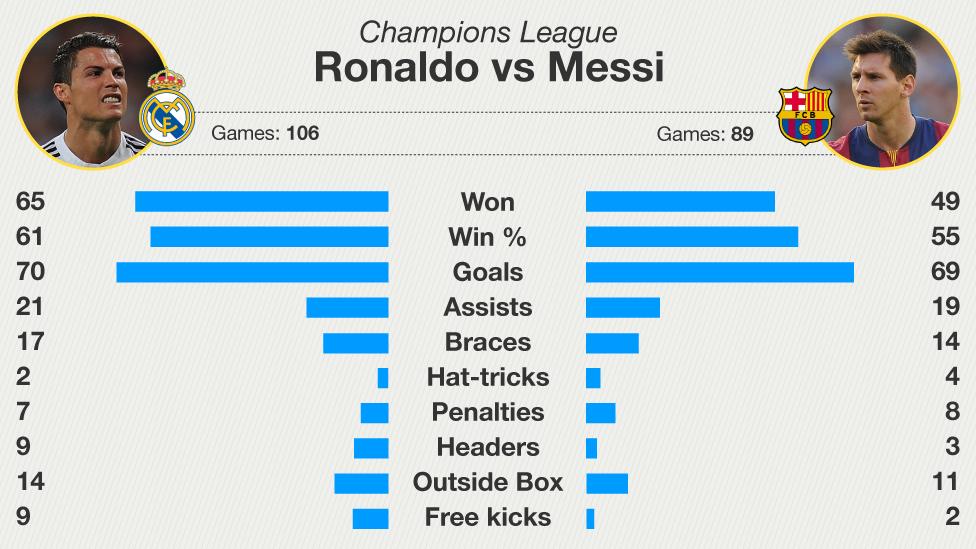
Identify the location of box. (530, 480).